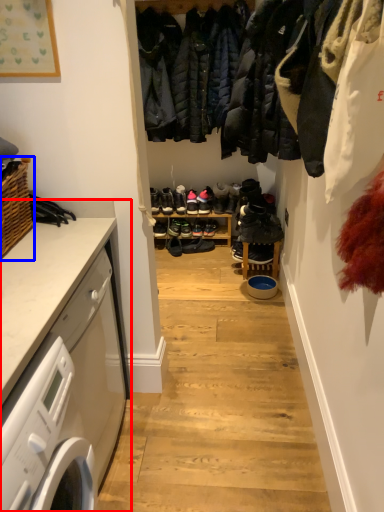
Question: Which object appears farthest to the camera in this image, countertop (highlighted by a red box) or basket (highlighted by a blue box)?

Choices:
 (A) countertop
 (B) basket

Answer: (B)